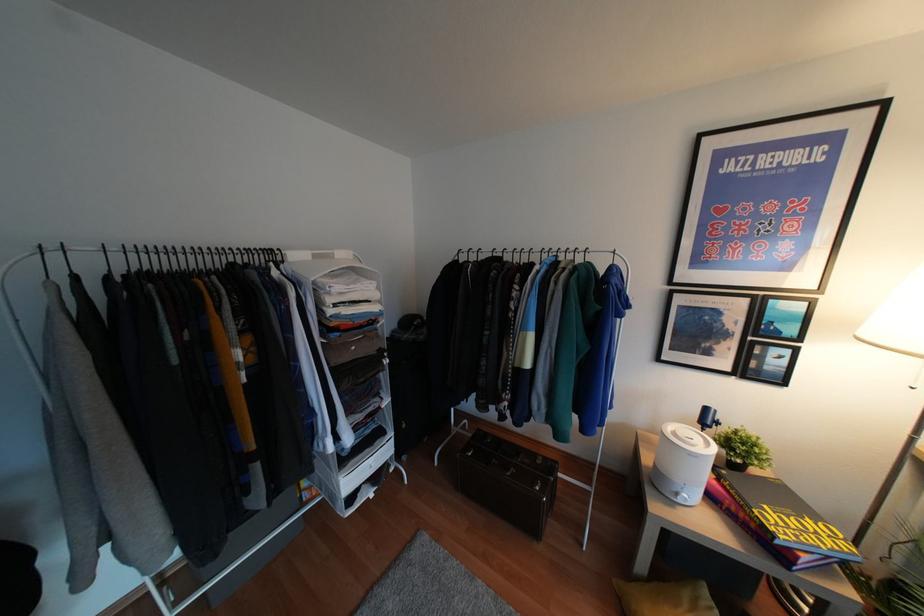
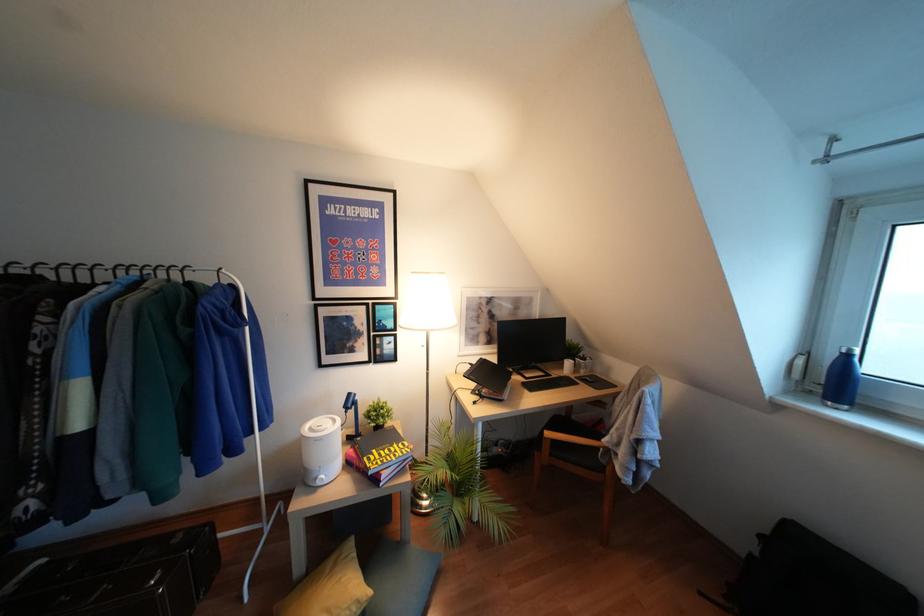
Question: The camera is either moving clockwise (left) or counter-clockwise (right) around the object. The first image is from the beginning of the video and the second image is from the end. Is the camera moving left or right when shooting the video?

Choices:
 (A) Left
 (B) Right

Answer: (A)